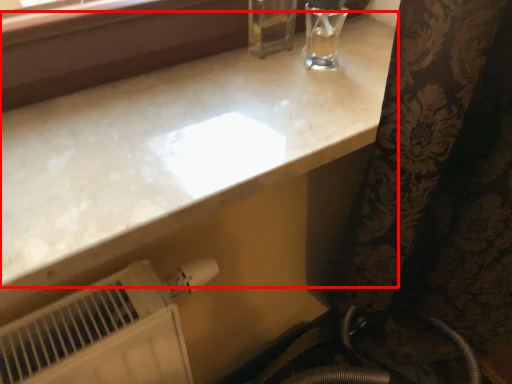
Question: In this image, where is countertop (annotated by the red box) located relative to water heater?

Choices:
 (A) right
 (B) left

Answer: (A)